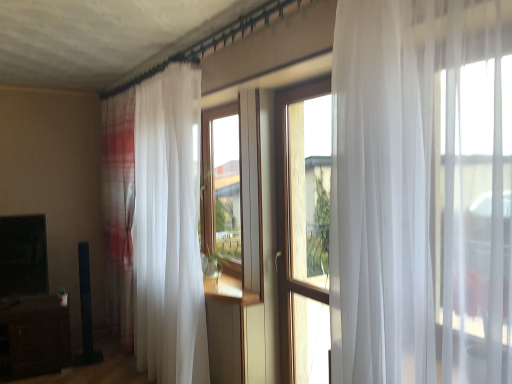
Question: Does wooden window at center come in front of brown wood entertainment center at lower left?

Choices:
 (A) yes
 (B) no

Answer: (A)

Question: Is wooden window at center positioned beyond the bounds of brown wood entertainment center at lower left?

Choices:
 (A) yes
 (B) no

Answer: (A)

Question: Is wooden window at center smaller than brown wood entertainment center at lower left?

Choices:
 (A) no
 (B) yes

Answer: (B)

Question: Can you confirm if wooden window at center is positioned to the left of brown wood entertainment center at lower left?

Choices:
 (A) no
 (B) yes

Answer: (A)

Question: Does wooden window at center have a lesser height compared to brown wood entertainment center at lower left?

Choices:
 (A) yes
 (B) no

Answer: (B)

Question: Is brown wood entertainment center at lower left inside the boundaries of white sheer curtain at left, or outside?

Choices:
 (A) outside
 (B) inside

Answer: (A)

Question: In terms of size, does brown wood entertainment center at lower left appear bigger or smaller than white sheer curtain at left?

Choices:
 (A) big
 (B) small

Answer: (B)

Question: From the image's perspective, is brown wood entertainment center at lower left located above or below white sheer curtain at left?

Choices:
 (A) above
 (B) below

Answer: (B)

Question: Is point (17, 319) closer or farther from the camera than point (138, 276)?

Choices:
 (A) farther
 (B) closer

Answer: (B)

Question: Does point (39, 261) appear closer or farther from the camera than point (287, 286)?

Choices:
 (A) farther
 (B) closer

Answer: (A)

Question: Considering the relative positions of brown wood entertainment center at lower left and wooden window at center in the image provided, is brown wood entertainment center at lower left to the left or to the right of wooden window at center?

Choices:
 (A) right
 (B) left

Answer: (B)

Question: In the image, is brown wood entertainment center at lower left positioned in front of or behind wooden window at center?

Choices:
 (A) behind
 (B) front

Answer: (A)

Question: Is brown wood entertainment center at lower left bigger or smaller than wooden window at center?

Choices:
 (A) small
 (B) big

Answer: (B)

Question: Visually, is white sheer curtain at left positioned to the left or to the right of wooden window at center?

Choices:
 (A) right
 (B) left

Answer: (B)

Question: From a real-world perspective, is white sheer curtain at left physically located above or below wooden window at center?

Choices:
 (A) above
 (B) below

Answer: (A)